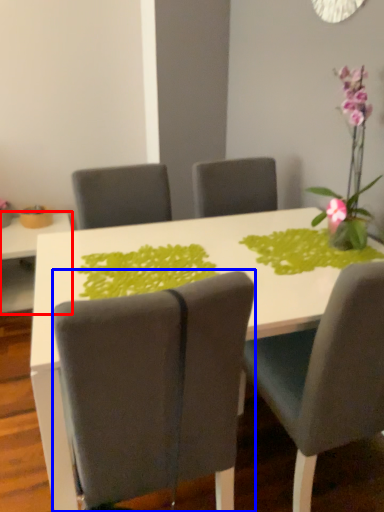
Question: Among these objects, which one is farthest to the camera, table (highlighted by a red box) or chair (highlighted by a blue box)?

Choices:
 (A) table
 (B) chair

Answer: (A)